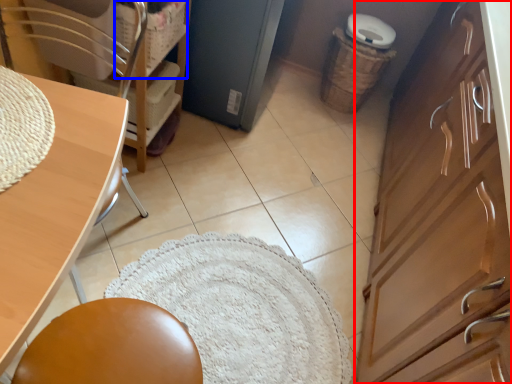
Question: Which object is closer to the camera taking this photo, cabinetry (highlighted by a red box) or basket (highlighted by a blue box)?

Choices:
 (A) cabinetry
 (B) basket

Answer: (A)